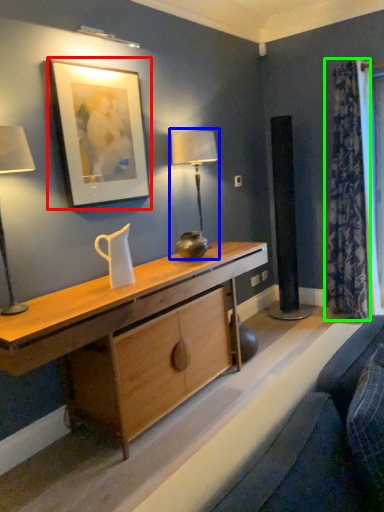
Question: Estimate the real-world distances between objects in this image. Which object is farther from picture frame (highlighted by a red box), table lamp (highlighted by a blue box) or curtain (highlighted by a green box)?

Choices:
 (A) table lamp
 (B) curtain

Answer: (B)